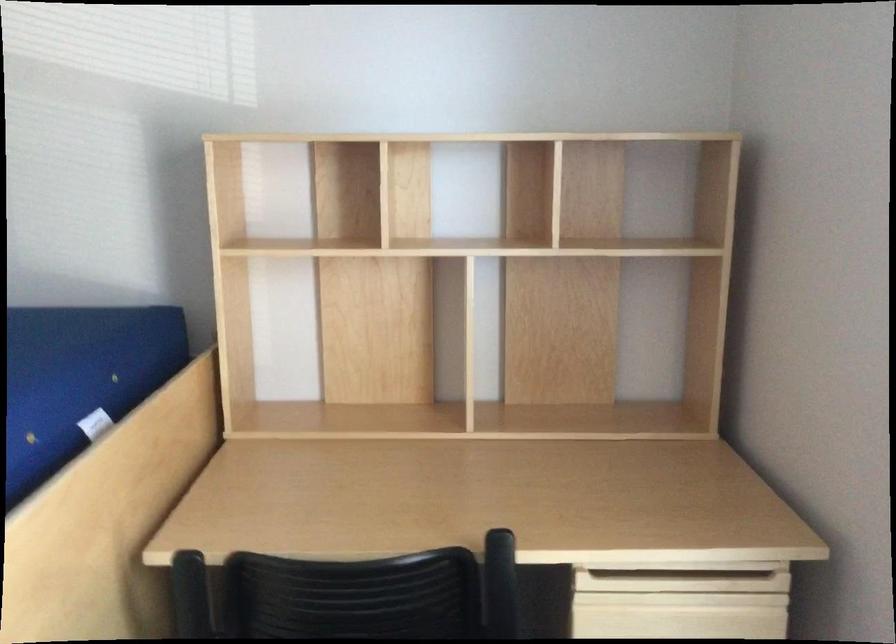
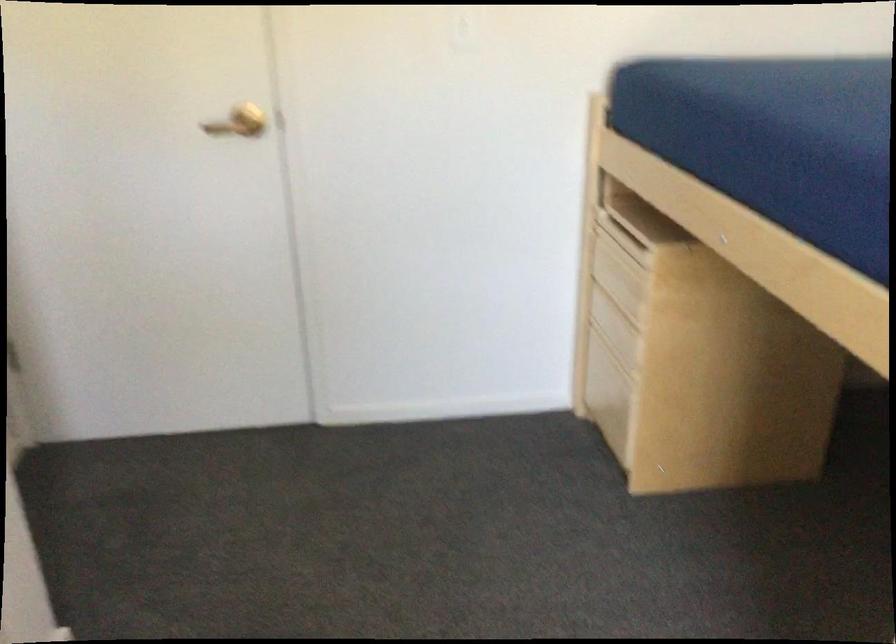
The first image is from the beginning of the video and the second image is from the end. How did the camera likely rotate when shooting the video?

The camera rotated toward left-down.